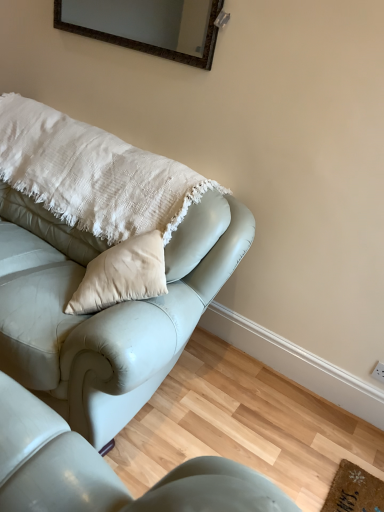
Question: Would you say leather couch at lower left, marked as the 2th studio couch in a top-to-bottom arrangement, is to the left or to the right of white cotton pillow at upper left in the picture?

Choices:
 (A) right
 (B) left

Answer: (A)

Question: Would you say leather couch at lower left, positioned as the 1th studio couch in bottom-to-top order, is inside or outside white cotton pillow at upper left?

Choices:
 (A) inside
 (B) outside

Answer: (B)

Question: Considering the real-world distances, which object is farthest from the matte brown frame at upper center?

Choices:
 (A) white cotton pillow at upper left
 (B) matte leather couch at upper left, which appears as the 2th studio couch when ordered from the bottom
 (C) leather couch at lower left, positioned as the 1th studio couch in bottom-to-top order

Answer: (C)

Question: Based on their relative distances, which object is farther from the matte brown frame at upper center?

Choices:
 (A) leather couch at lower left, marked as the 2th studio couch in a top-to-bottom arrangement
 (B) white cotton pillow at upper left
 (C) matte leather couch at upper left, which appears as the 2th studio couch when ordered from the bottom

Answer: (A)